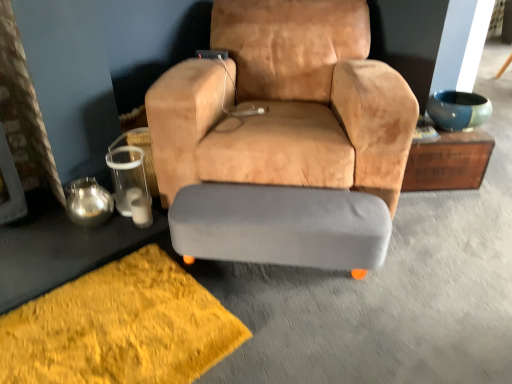
You are a GUI agent. You are given a task and a screenshot of the screen. Output one action in this format:
    pyautogui.click(x=<x>, y=<y>)
    Task: Click on the free space above wooden chest at upper right, the second table when ordered from bottom to top (from a real-world perspective)
    Image resolution: width=512 pixels, height=384 pixels.
    Given the screenshot: What is the action you would take?
    pyautogui.click(x=441, y=136)